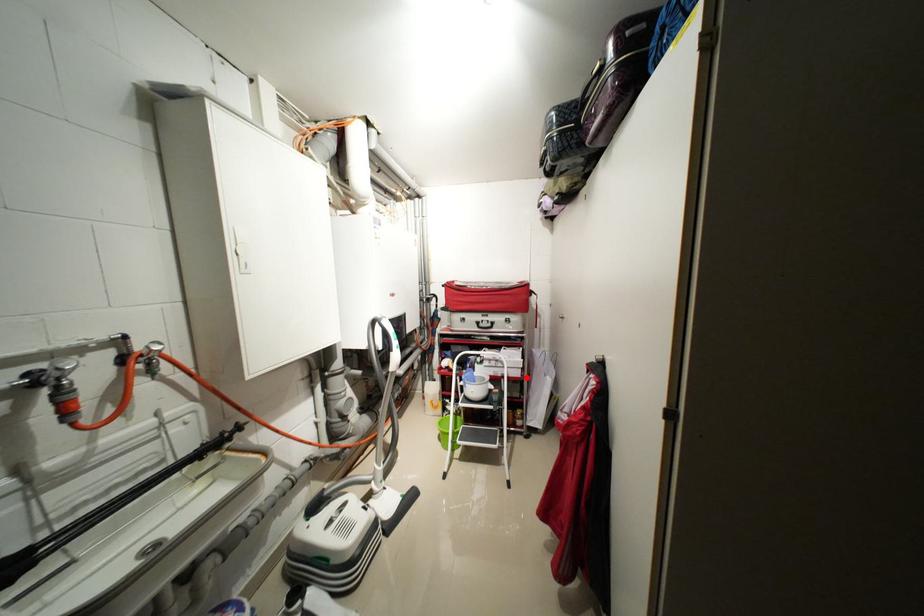
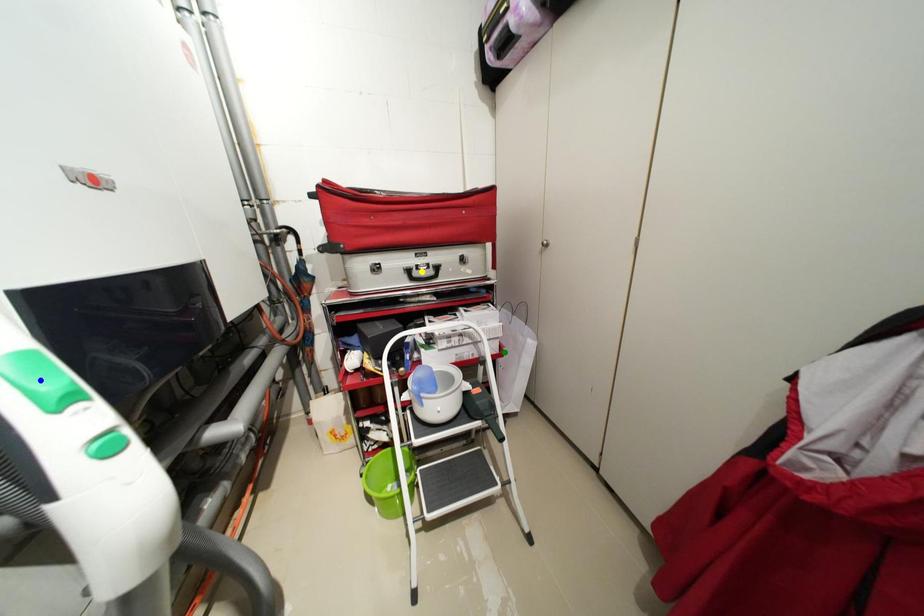
Question: I am providing you with two images of the same scene from different viewpoints. A red point is marked on the first image. You are given multiple points on the second image. Which spot in image 2 lines up with the point in image 1?

Choices:
 (A) blue point
 (B) yellow point
 (C) green point

Answer: (C)